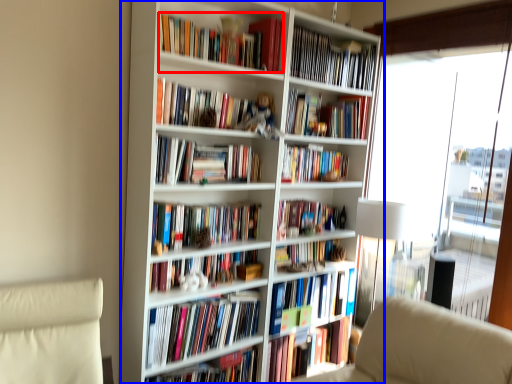
Question: Which object appears farthest to the camera in this image, book (highlighted by a red box) or bookcase (highlighted by a blue box)?

Choices:
 (A) book
 (B) bookcase

Answer: (A)